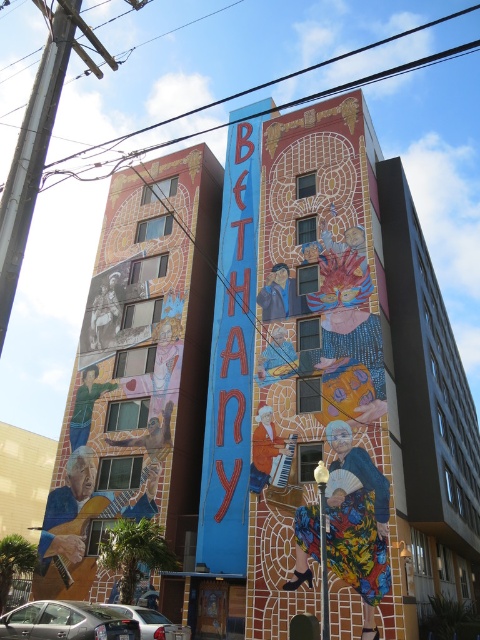
Does multicolored mosaic at left appear on the left side of silver metallic car at lower left?

Yes, multicolored mosaic at left is to the left of silver metallic car at lower left.

Which is more to the right, multicolored mosaic at left or silver metallic car at lower left?

silver metallic car at lower left is more to the right.

The width and height of the screenshot is (480, 640). I want to click on multicolored mosaic at left, so click(x=136, y=372).